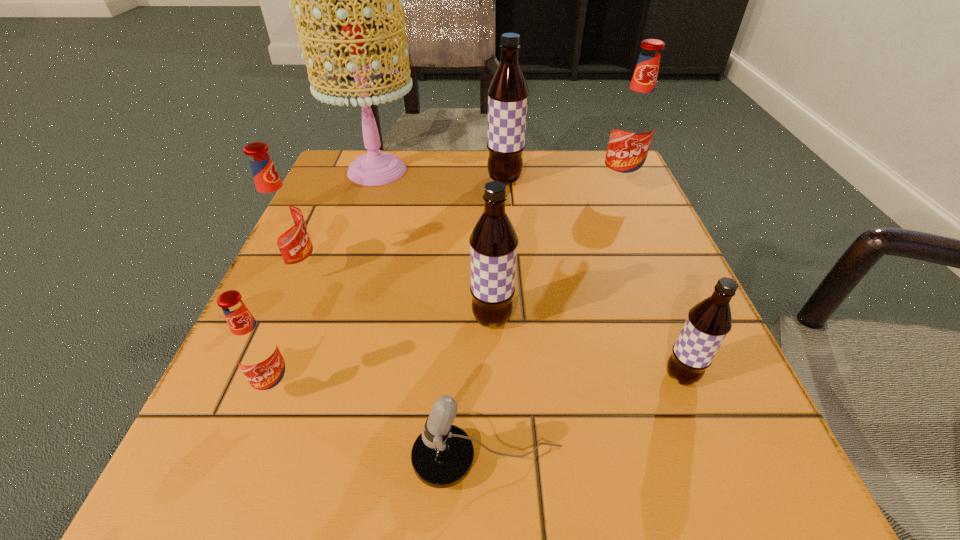
Image resolution: width=960 pixels, height=540 pixels. Identify the location of lampshade. (374, 168).

Identify the location of the biggest red root beer. (633, 125).

Where is `the farthest red root beer`? This screenshot has width=960, height=540. the farthest red root beer is located at coordinates (633, 125).

Find the location of a particular element. This screenshot has height=540, width=960. the farthest brown root beer is located at coordinates (508, 92).

Locate an element on the screen. This screenshot has height=540, width=960. the second smallest red root beer is located at coordinates (280, 218).

Where is `the second nearest red root beer`? This screenshot has width=960, height=540. the second nearest red root beer is located at coordinates (280, 218).

Where is `the second biggest brown root beer`? the second biggest brown root beer is located at coordinates (493, 242).

In order to click on the fifth farthest object in this screenshot , I will do `click(493, 242)`.

Image resolution: width=960 pixels, height=540 pixels. In order to click on the nearest red root beer in this screenshot , I will do `click(255, 349)`.

Identify the location of the rightmost brown root beer. (708, 322).